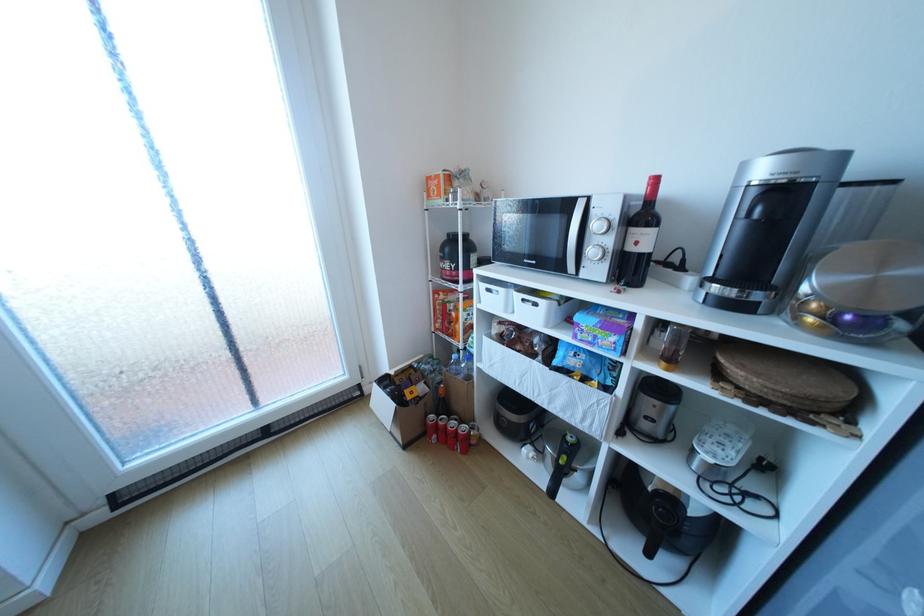
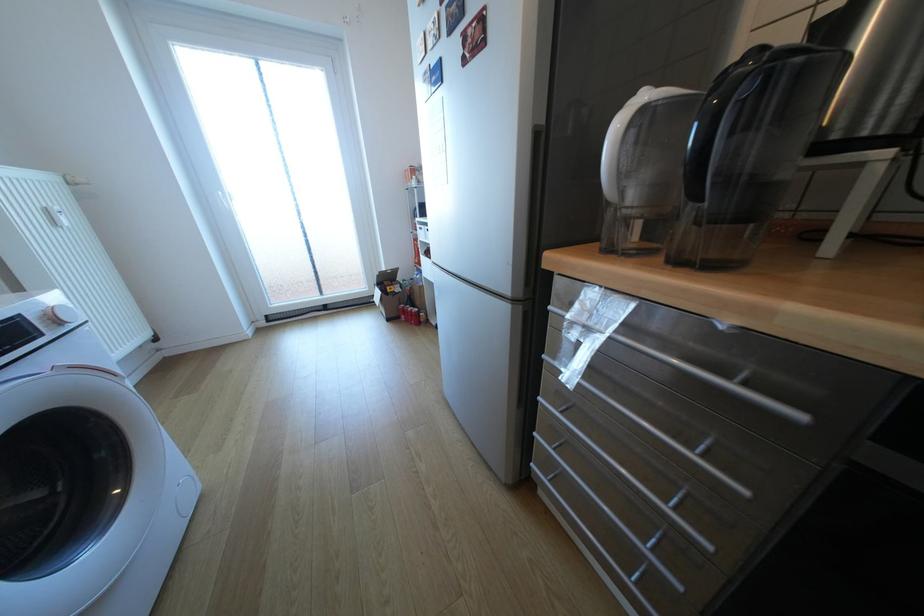
Find the pixel in the second image that matches point 444,437 in the first image.

(411, 315)